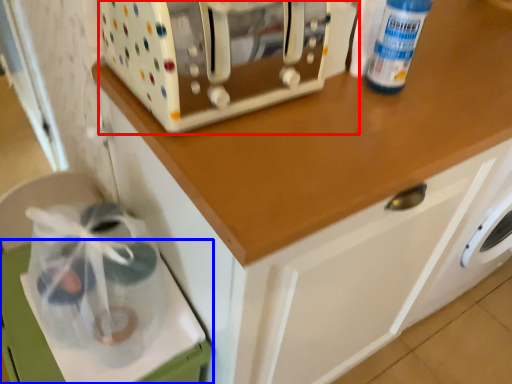
Question: Which object is closer to the camera taking this photo, home appliance (highlighted by a red box) or cabinetry (highlighted by a blue box)?

Choices:
 (A) home appliance
 (B) cabinetry

Answer: (A)